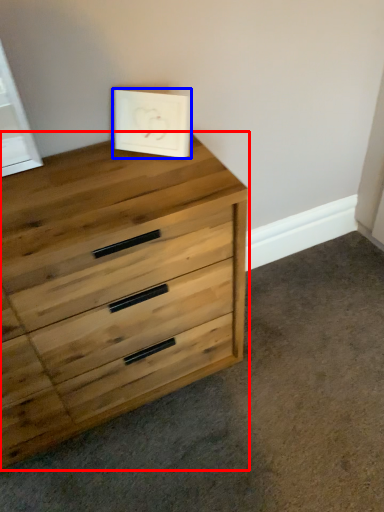
Question: Among these objects, which one is nearest to the camera, chest of drawers (highlighted by a red box) or picture frame (highlighted by a blue box)?

Choices:
 (A) chest of drawers
 (B) picture frame

Answer: (A)